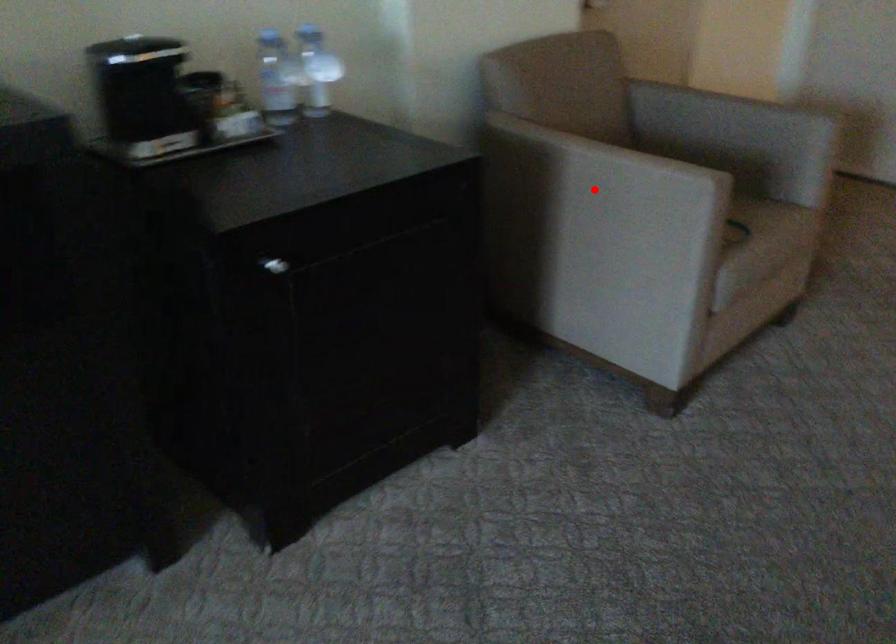
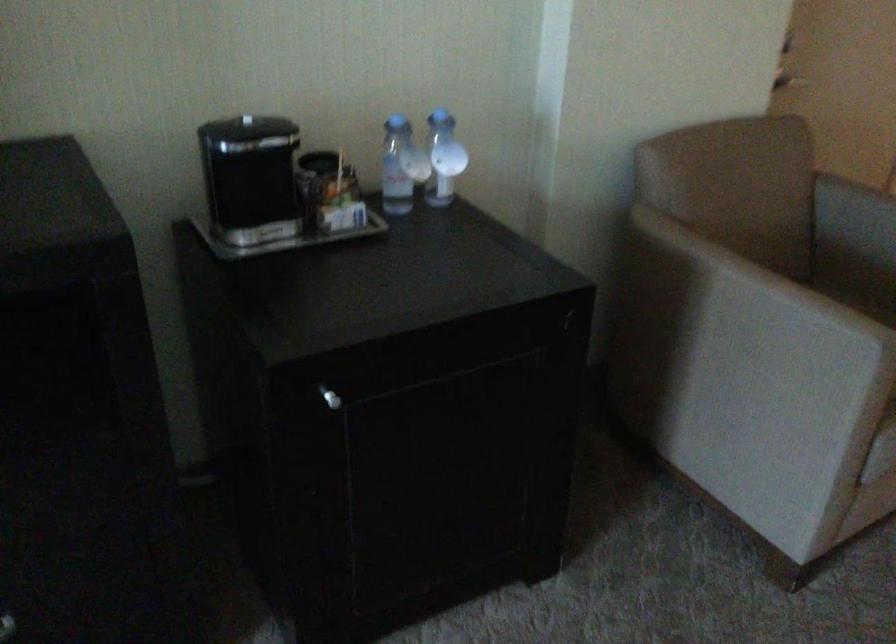
Question: I am providing you with two images of the same scene from different viewpoints. A red point is marked on the first image. Can you still see the location of the red point in image 2?

Choices:
 (A) Yes
 (B) No

Answer: (A)